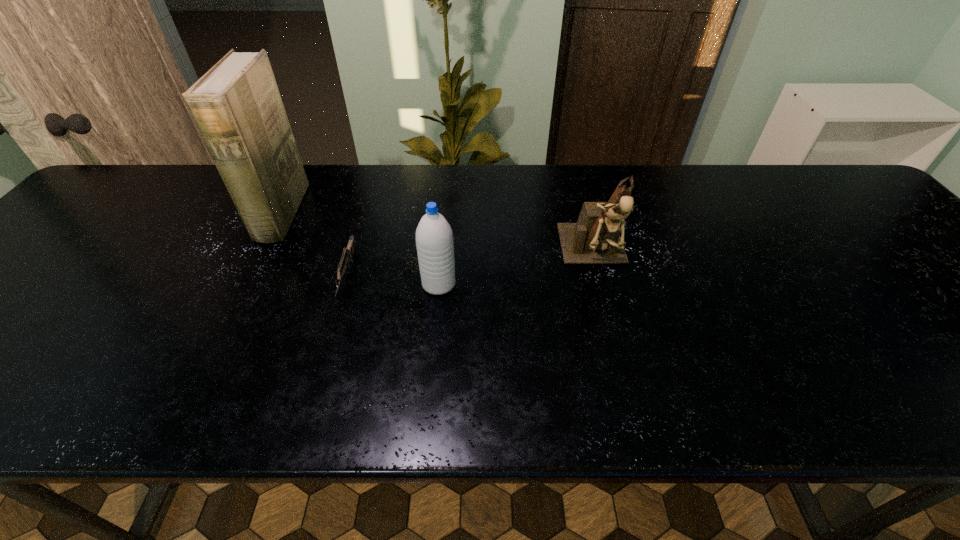
This screenshot has height=540, width=960. I want to click on phonebook, so click(236, 106).

This screenshot has width=960, height=540. What are the coordinates of `the tallest object` in the screenshot? It's located at (236, 106).

Locate an element on the screen. The width and height of the screenshot is (960, 540). figurine is located at coordinates (595, 239).

Locate an element on the screen. The width and height of the screenshot is (960, 540). the rightmost object is located at coordinates (595, 239).

This screenshot has width=960, height=540. Identify the location of water bottle. (434, 240).

Find the location of a particular element. Image resolution: width=960 pixels, height=540 pixels. the second object from right to left is located at coordinates (434, 240).

What are the coordinates of `the shortest object` in the screenshot? It's located at (347, 255).

Where is `gun`? This screenshot has width=960, height=540. gun is located at coordinates (347, 255).

The height and width of the screenshot is (540, 960). I want to click on vacant area situated on the cover of the leftmost object, so click(x=357, y=214).

This screenshot has width=960, height=540. What are the coordinates of `free space located on the front-facing side of the figurine` in the screenshot? It's located at (612, 326).